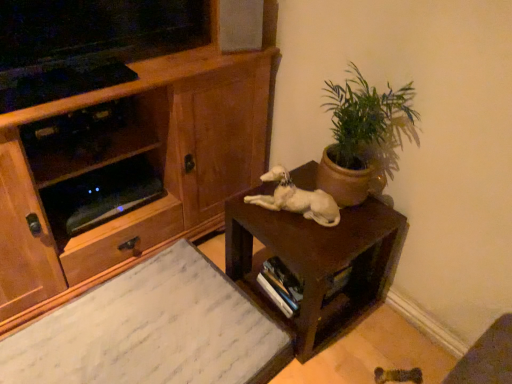
Question: Is brown matte table at center thinner than white glossy dog at center?

Choices:
 (A) yes
 (B) no

Answer: (B)

Question: Can you confirm if brown matte table at center is bigger than white glossy dog at center?

Choices:
 (A) yes
 (B) no

Answer: (A)

Question: Would you say brown matte table at center contains white glossy dog at center?

Choices:
 (A) no
 (B) yes

Answer: (A)

Question: Are brown matte table at center and white glossy dog at center beside each other?

Choices:
 (A) yes
 (B) no

Answer: (B)

Question: Would you say brown matte table at center is outside white glossy dog at center?

Choices:
 (A) no
 (B) yes

Answer: (B)

Question: Is brown matte table at center smaller than white glossy dog at center?

Choices:
 (A) yes
 (B) no

Answer: (B)

Question: Is green matte plant at upper right positioned far away from white glossy dog at center?

Choices:
 (A) yes
 (B) no

Answer: (B)

Question: Does green matte plant at upper right have a larger size compared to white glossy dog at center?

Choices:
 (A) yes
 (B) no

Answer: (A)

Question: From a real-world perspective, is green matte plant at upper right on white glossy dog at center?

Choices:
 (A) yes
 (B) no

Answer: (A)

Question: Is green matte plant at upper right wider than white glossy dog at center?

Choices:
 (A) yes
 (B) no

Answer: (B)

Question: Is green matte plant at upper right at the left side of white glossy dog at center?

Choices:
 (A) no
 (B) yes

Answer: (A)

Question: Is green matte plant at upper right turned away from white glossy dog at center?

Choices:
 (A) no
 (B) yes

Answer: (A)

Question: Can you confirm if green matte plant at upper right is bigger than brown matte table at center?

Choices:
 (A) yes
 (B) no

Answer: (B)